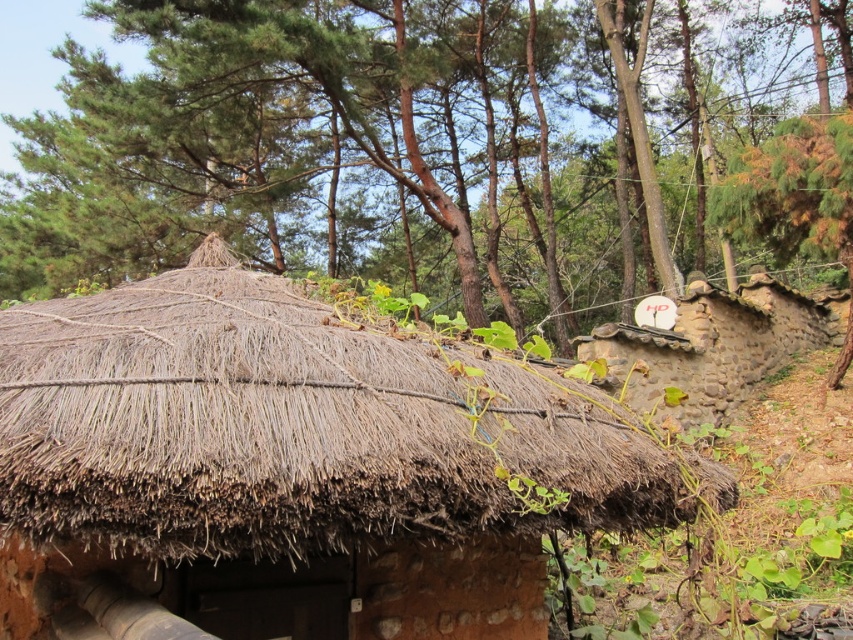
You are standing in the rustic outdoor setting and want to take a photo of the brown thatch roof at center and the brown stone hut at upper right. Which object should you point your camera towards first if you want to capture both in a single frame without moving the camera?

You should point your camera towards the brown stone hut at upper right first because the brown thatch roof at center is below it, ensuring both will be in the frame when the camera is aimed at the higher object.

You are standing in the rustic outdoor setting and want to place a new decorative item. If you want to place it directly below the brown thatch roof at upper center, where should you position it?

The brown thatch roof at upper center is located at point 0.233 on the horizontal axis and 0.513 on the vertical axis. To place the decorative item directly below it, position it at the same horizontal coordinate 0.233 but lower on the vertical axis, such as 0.4 or 0.3.

You are standing in the rustic outdoor setting and want to place a 1.5 meter tall decorative statue between the brown thatch roof at upper center and the brown thatch roof at center. Can you fit it there without it touching either roof?

The distance between the brown thatch roof at upper center and the brown thatch roof at center is 10.05 meters. Since the statue is only 1.5 meters tall, there is sufficient vertical space to place it between them without touching either roof.